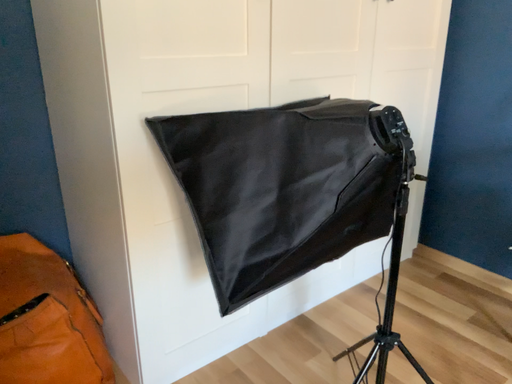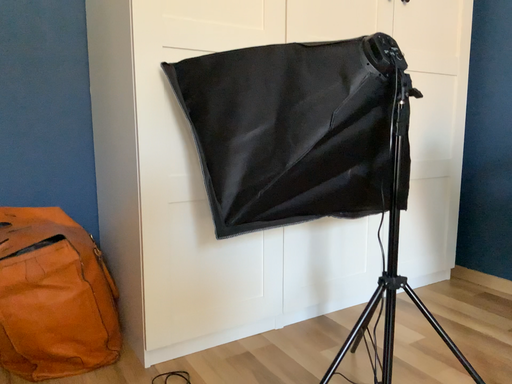
Question: Which way did the camera rotate in the video?

Choices:
 (A) rotated right
 (B) rotated left

Answer: (B)